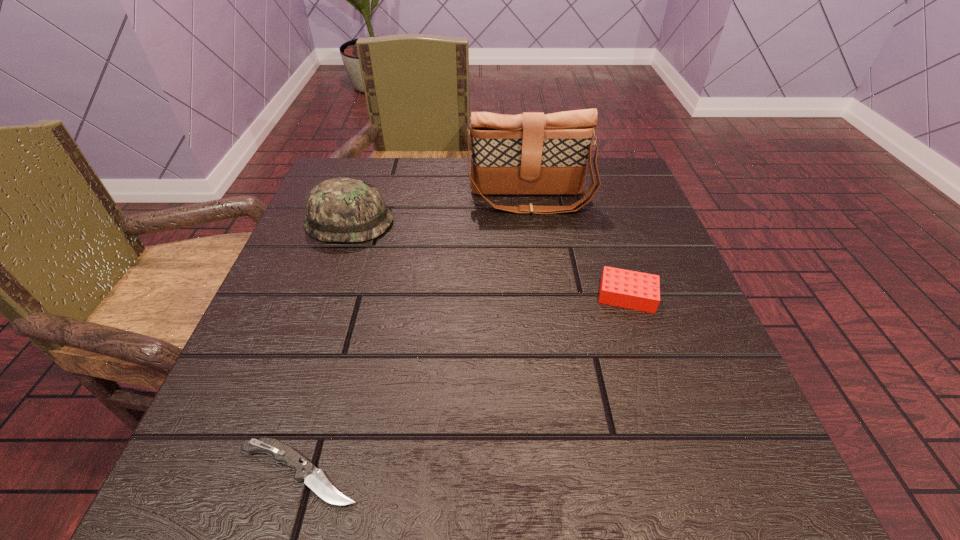
You are a GUI agent. You are given a task and a screenshot of the screen. Output one action in this format:
    pyautogui.click(x=<x>, y=<y>)
    Task: Click on the shoulder bag that is at the far edge
    
    Given the screenshot: What is the action you would take?
    pyautogui.click(x=531, y=153)

Where is `headwear at the far edge`? Image resolution: width=960 pixels, height=540 pixels. headwear at the far edge is located at coordinates (339, 209).

Find the location of a particular element. This screenshot has width=960, height=540. object that is at the near edge is located at coordinates (314, 478).

The width and height of the screenshot is (960, 540). I want to click on headwear present at the left edge, so click(x=339, y=209).

I want to click on pocketknife at the left edge, so click(x=314, y=478).

You are a GUI agent. You are given a task and a screenshot of the screen. Output one action in this format:
    pyautogui.click(x=<x>, y=<y>)
    Task: Click on the shoulder bag at the right edge
    This screenshot has height=540, width=960.
    Given the screenshot: What is the action you would take?
    pyautogui.click(x=531, y=153)

The height and width of the screenshot is (540, 960). I want to click on Lego situated at the right edge, so click(x=635, y=290).

The image size is (960, 540). Find the location of `object that is at the far left corner`. object that is at the far left corner is located at coordinates [x=339, y=209].

Where is `object that is positioned at the near left corner`? The height and width of the screenshot is (540, 960). object that is positioned at the near left corner is located at coordinates (314, 478).

You are a GUI agent. You are given a task and a screenshot of the screen. Output one action in this format:
    pyautogui.click(x=<x>, y=<y>)
    Task: Click on the object located at the far right corner
    The image size is (960, 540).
    Given the screenshot: What is the action you would take?
    pyautogui.click(x=531, y=153)